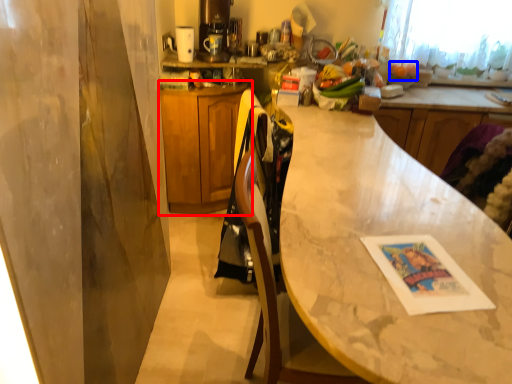
Question: Which object is further to the camera taking this photo, cabinetry (highlighted by a red box) or fruit (highlighted by a blue box)?

Choices:
 (A) cabinetry
 (B) fruit

Answer: (B)